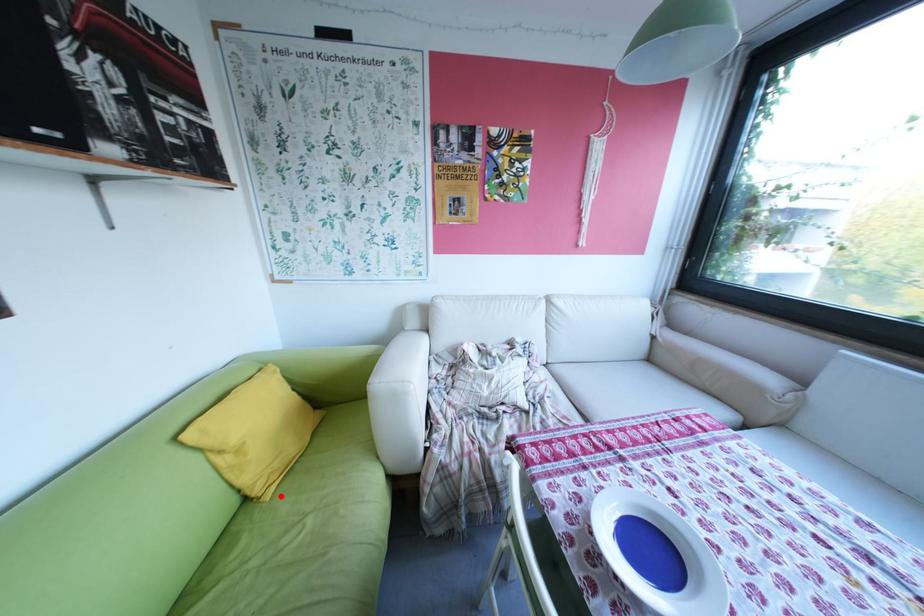
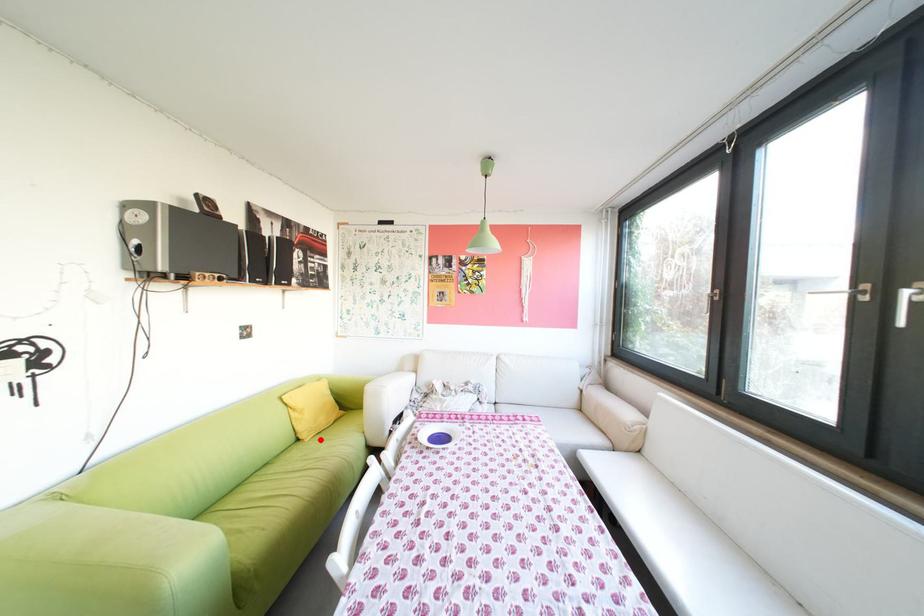
I am providing you with two images of the same scene from different viewpoints. A red point is marked on the first image and another point is marked on the second image. Are the points marked in image1 and image2 representing the same 3D position?

Yes